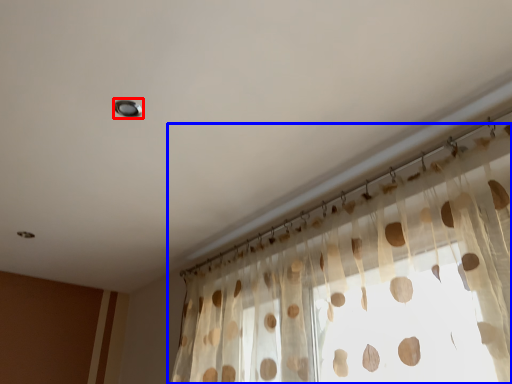
Question: Which object is closer to the camera taking this photo, light (highlighted by a red box) or curtain (highlighted by a blue box)?

Choices:
 (A) light
 (B) curtain

Answer: (B)